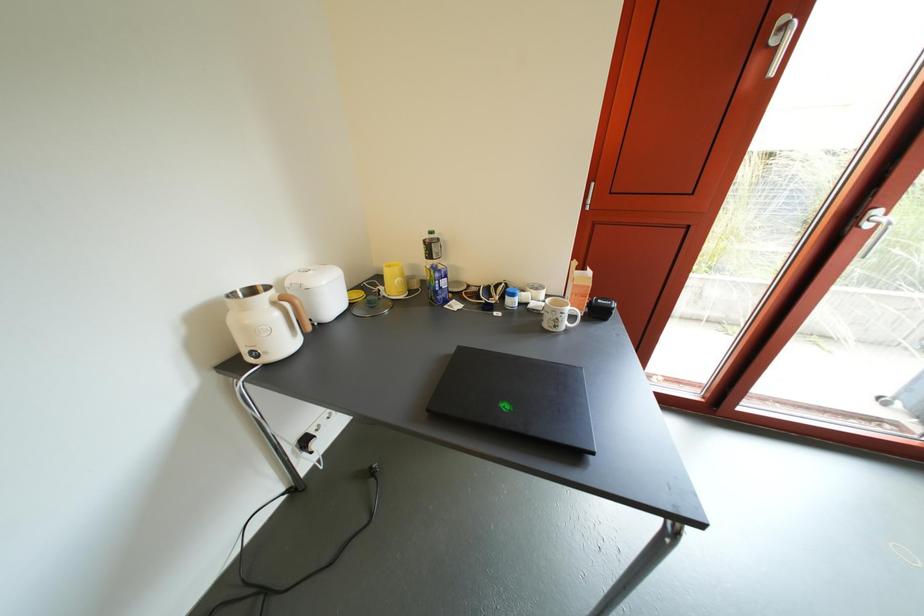
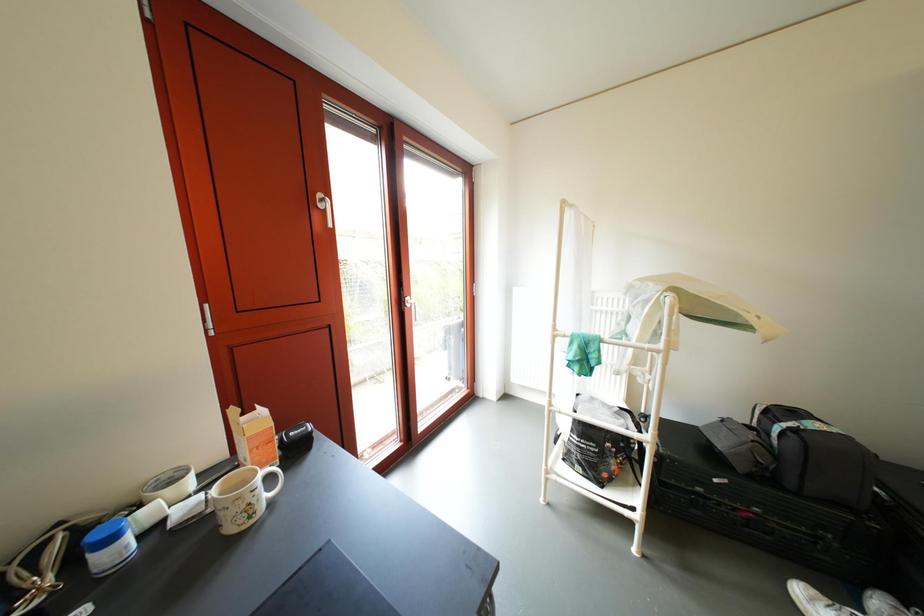
Question: Based on the continuous images, in which direction is the camera rotating? Reply with the corresponding letter.

Choices:
 (A) Left
 (B) Right
 (C) Up
 (D) Down

Answer: (B)